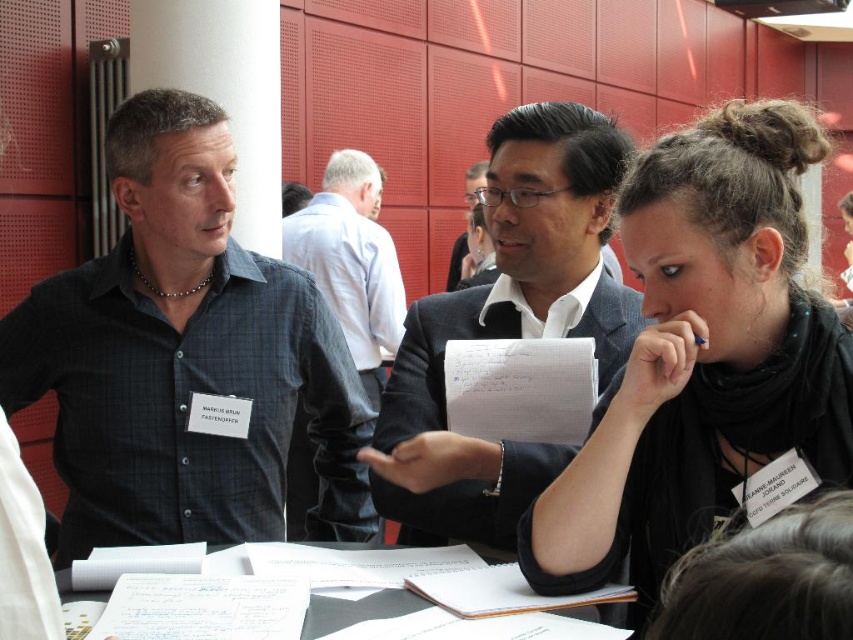
You are organizing a photo shoot and need to arrange the black checkered shirt at left and the matte black suit at center in a row for a lineup. Based on their widths, which should be placed first if you want the wider one to be in the middle?

The black checkered shirt at left might be wider than matte black suit at center, so to place the wider one in the middle, the black checkered shirt at left should be positioned first in the lineup.

In the scene, there are two people wearing suits at the center. The first is wearing a dark gray suit at center, and the second is wearing a matte black suit at center. According to their positions, which suit is located to the right?

The dark gray suit at center is to the right of the matte black suit at center.